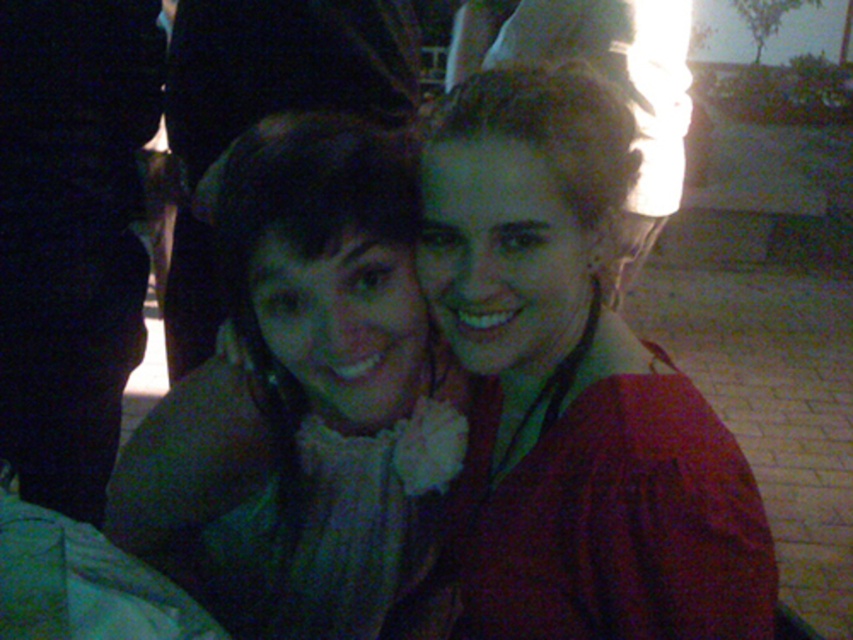
Question: From the image, what is the correct spatial relationship of matte red sweater at center in relation to green fabric scarf at center?

Choices:
 (A) left
 (B) right

Answer: (B)

Question: Can you confirm if matte red sweater at center is positioned below green fabric scarf at center?

Choices:
 (A) no
 (B) yes

Answer: (A)

Question: Is matte red sweater at center positioned at the back of green fabric scarf at center?

Choices:
 (A) no
 (B) yes

Answer: (A)